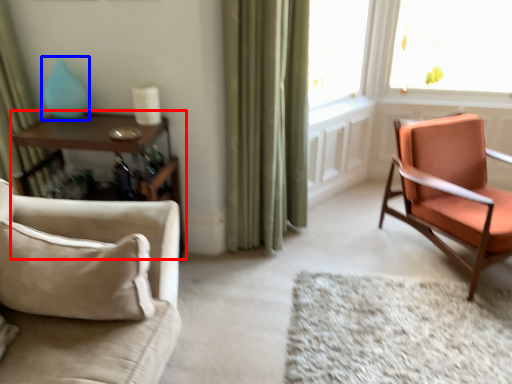
Question: Among these objects, which one is farthest to the camera, table (highlighted by a red box) or turquoise (highlighted by a blue box)?

Choices:
 (A) table
 (B) turquoise

Answer: (B)